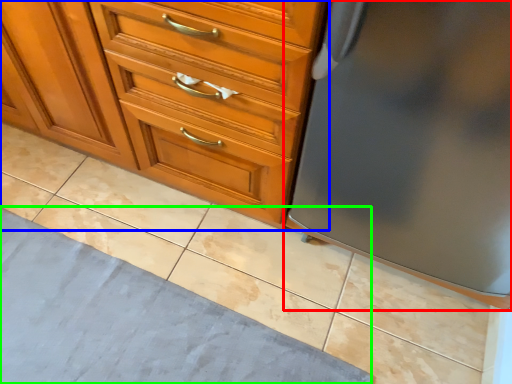
Question: Considering the real-world distances, which object is closest to refrigerator (highlighted by a red box)? chest of drawers (highlighted by a blue box) or bath mat (highlighted by a green box).

Choices:
 (A) chest of drawers
 (B) bath mat

Answer: (A)